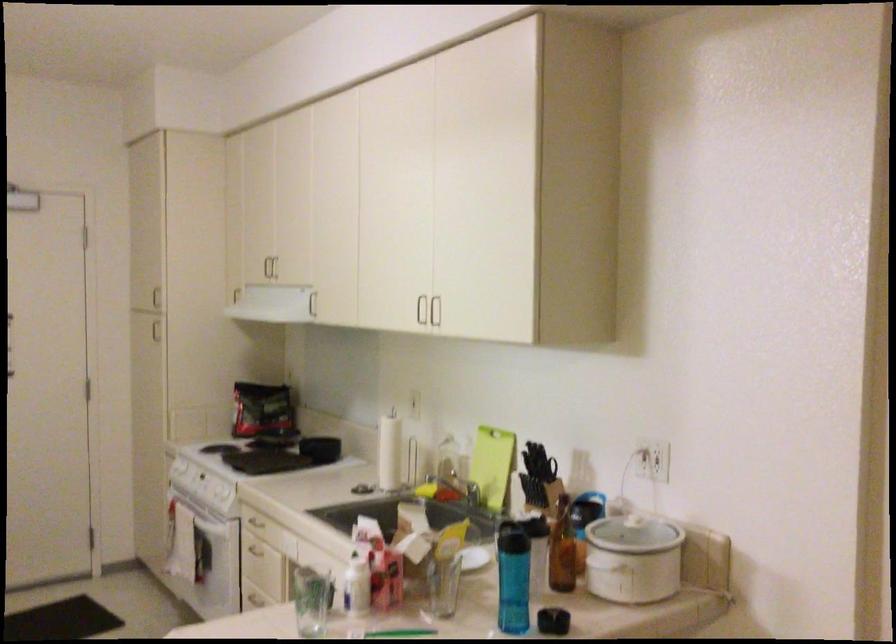
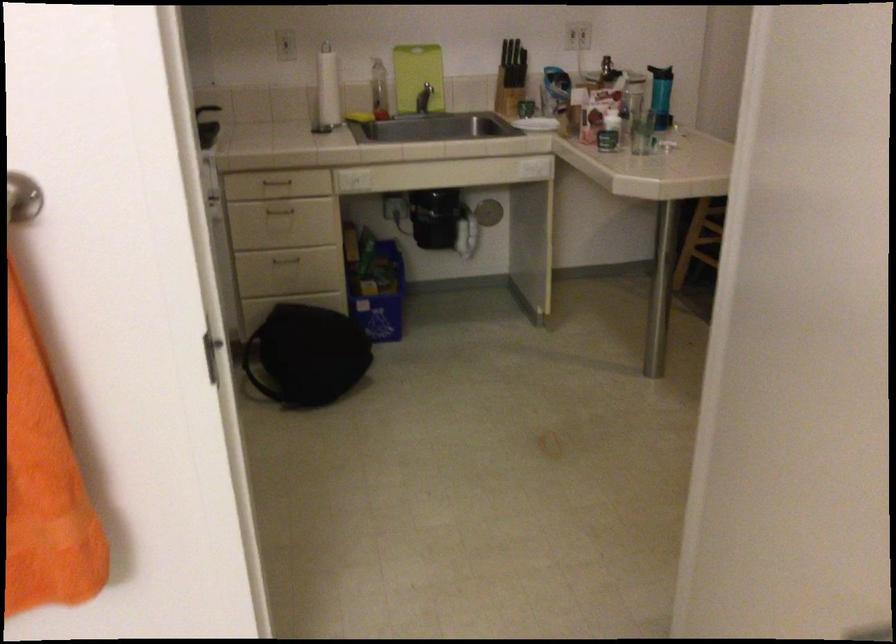
The point at (470, 469) is marked in the first image. Where is the corresponding point in the second image?

(378, 90)